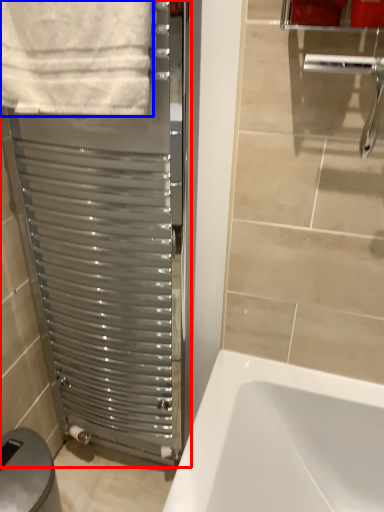
Question: Which object appears closest to the camera in this image, screen door (highlighted by a red box) or towel (highlighted by a blue box)?

Choices:
 (A) screen door
 (B) towel

Answer: (B)